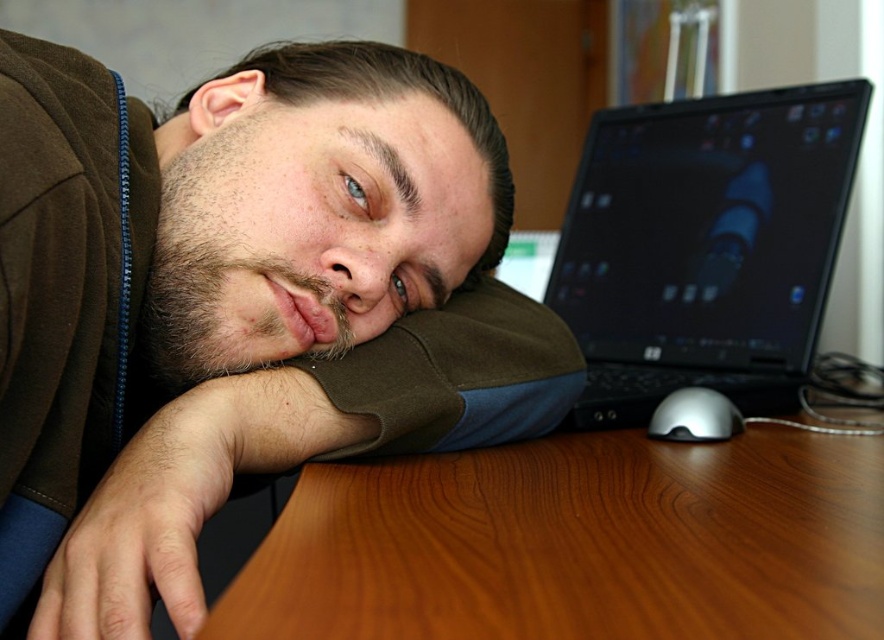
Question: Among these objects, which one is farthest from the camera?

Choices:
 (A) brown suede jacket at center
 (B) brown matte head at center

Answer: (B)

Question: Can you confirm if brown suede jacket at center is positioned to the left of silver metallic mouse at lower right?

Choices:
 (A) no
 (B) yes

Answer: (B)

Question: Is brown suede jacket at center bigger than brown matte head at center?

Choices:
 (A) no
 (B) yes

Answer: (B)

Question: Which of the following is the closest to the observer?

Choices:
 (A) brown suede jacket at center
 (B) brown matte head at center

Answer: (A)

Question: Is the position of wooden at center more distant than that of brown matte head at center?

Choices:
 (A) no
 (B) yes

Answer: (A)

Question: Which point is closer to the camera taking this photo?

Choices:
 (A) (749, 248)
 (B) (412, 604)
 (C) (442, 216)
 (D) (153, 164)

Answer: (B)